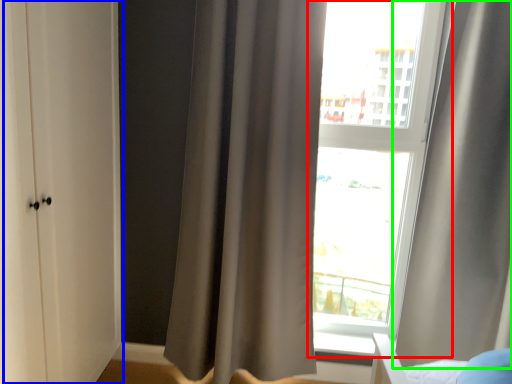
Question: Which object is positioned closest to window (highlighted by a red box)? Select from screen door (highlighted by a blue box) and curtain (highlighted by a green box).

Choices:
 (A) screen door
 (B) curtain

Answer: (B)